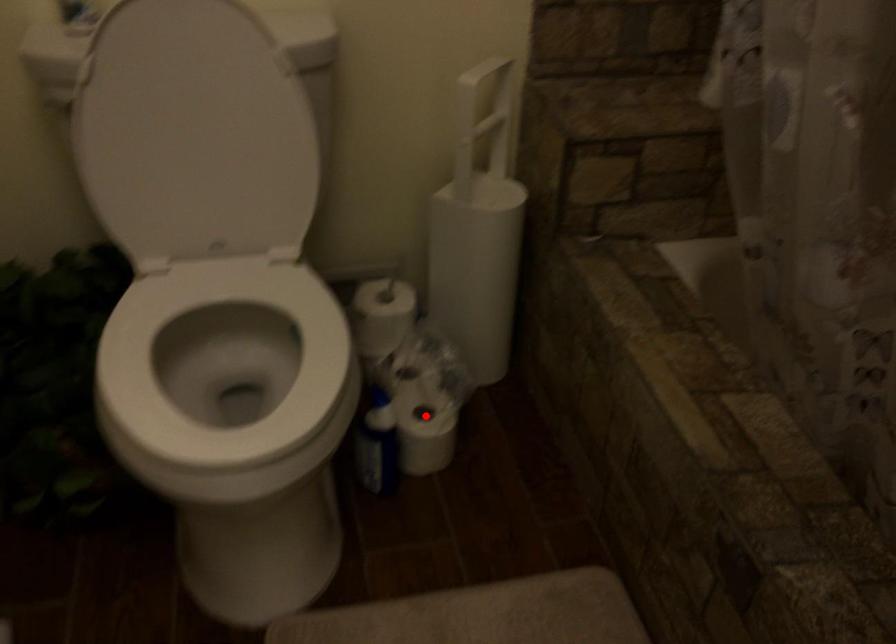
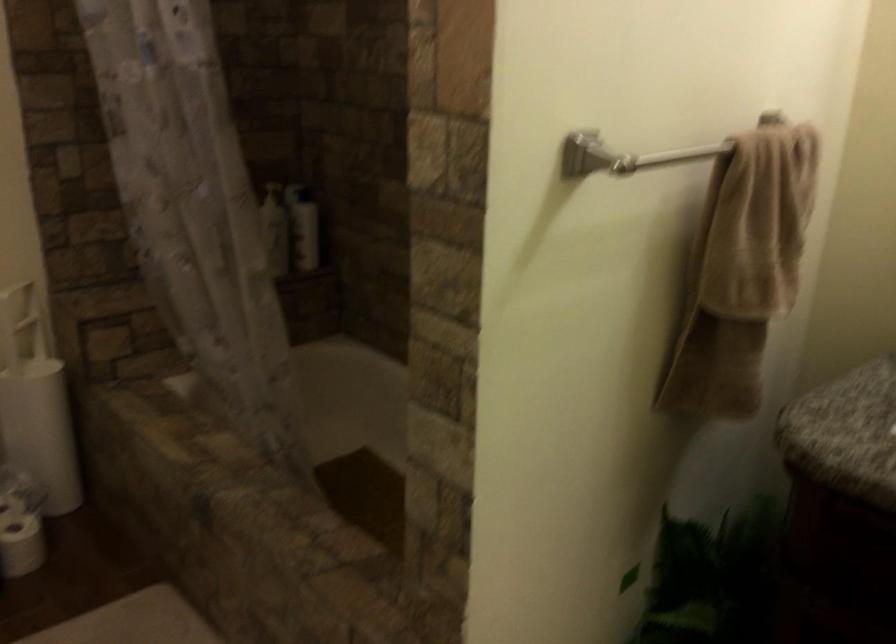
Question: I am providing you with two images of the same scene from different viewpoints. A red point is marked on the first image. Is the red point's position out of view in image 2?

Choices:
 (A) Yes
 (B) No

Answer: (B)